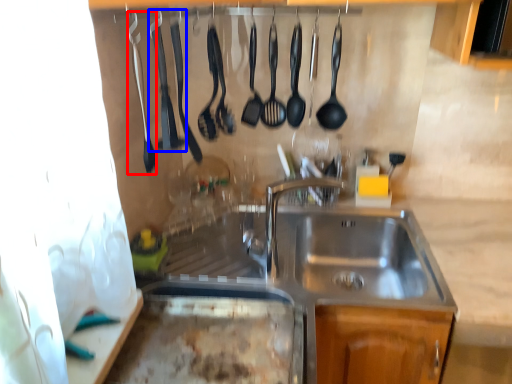
Question: Which object is further to the camera taking this photo, silverware (highlighted by a red box) or silverware (highlighted by a blue box)?

Choices:
 (A) silverware
 (B) silverware

Answer: (B)